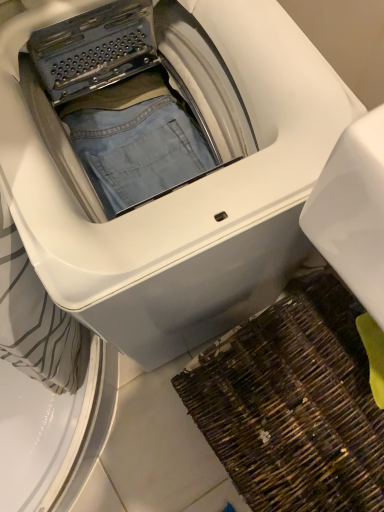
Question: Considering the relative positions of brown woven mat at lower right and white glossy washing machine at center in the image provided, is brown woven mat at lower right in front of white glossy washing machine at center?

Choices:
 (A) yes
 (B) no

Answer: (B)

Question: Would you consider brown woven mat at lower right to be distant from white glossy washing machine at center?

Choices:
 (A) no
 (B) yes

Answer: (A)

Question: Would you say brown woven mat at lower right is outside white glossy washing machine at center?

Choices:
 (A) yes
 (B) no

Answer: (A)

Question: Is brown woven mat at lower right positioned behind white glossy washing machine at center?

Choices:
 (A) no
 (B) yes

Answer: (B)

Question: Considering the relative sizes of brown woven mat at lower right and white glossy washing machine at center in the image provided, is brown woven mat at lower right taller than white glossy washing machine at center?

Choices:
 (A) no
 (B) yes

Answer: (A)

Question: From a real-world perspective, is brown woven mat at lower right over white glossy washing machine at center?

Choices:
 (A) no
 (B) yes

Answer: (A)

Question: From a real-world perspective, does white glossy washing machine at center sit lower than brown woven mat at lower right?

Choices:
 (A) no
 (B) yes

Answer: (A)

Question: Considering the relative sizes of white glossy washing machine at center and brown woven mat at lower right in the image provided, is white glossy washing machine at center thinner than brown woven mat at lower right?

Choices:
 (A) no
 (B) yes

Answer: (A)

Question: Is brown woven mat at lower right a part of white glossy washing machine at center?

Choices:
 (A) no
 (B) yes

Answer: (A)

Question: Does white glossy washing machine at center have a larger size compared to brown woven mat at lower right?

Choices:
 (A) yes
 (B) no

Answer: (A)

Question: Is white glossy washing machine at center far from brown woven mat at lower right?

Choices:
 (A) no
 (B) yes

Answer: (A)

Question: From a real-world perspective, is white glossy washing machine at center on top of brown woven mat at lower right?

Choices:
 (A) no
 (B) yes

Answer: (B)

Question: Is brown woven mat at lower right situated inside white glossy washing machine at center or outside?

Choices:
 (A) inside
 (B) outside

Answer: (B)